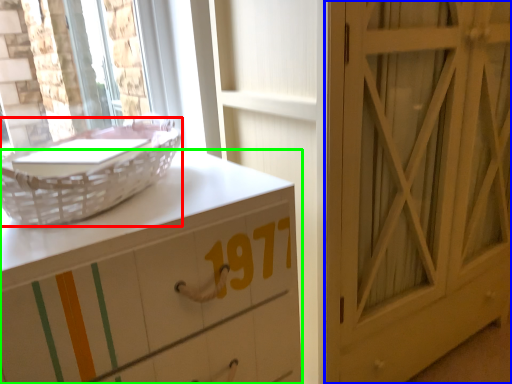
Question: Which object is positioned farthest from basket (highlighted by a red box)? Select from door (highlighted by a blue box) and chest of drawers (highlighted by a green box).

Choices:
 (A) door
 (B) chest of drawers

Answer: (A)